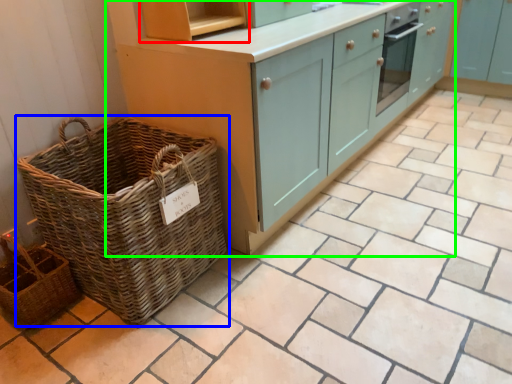
Question: Considering the real-world distances, which object is farthest from shelf (highlighted by a red box)? picnic basket (highlighted by a blue box) or cabinetry (highlighted by a green box)?

Choices:
 (A) picnic basket
 (B) cabinetry

Answer: (A)